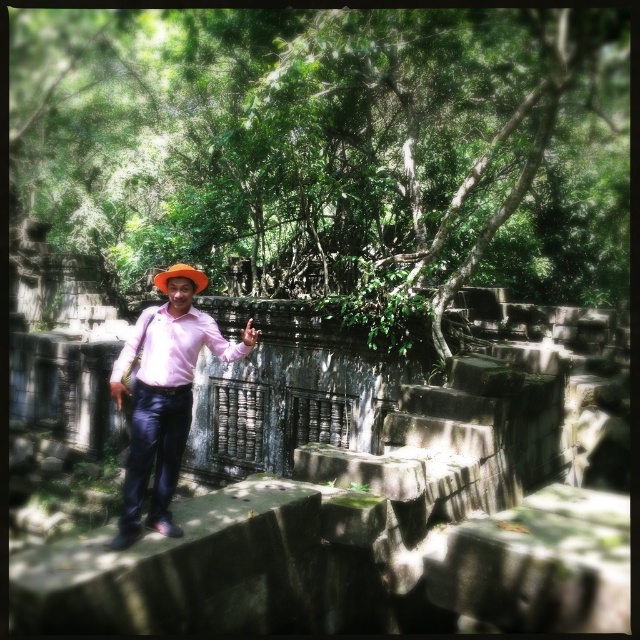
Question: Is pink matte shirt at center to the right of orange felt hat at center from the viewer's perspective?

Choices:
 (A) no
 (B) yes

Answer: (B)

Question: Among these points, which one is farthest from the camera?

Choices:
 (A) (154, 285)
 (B) (168, 336)

Answer: (A)

Question: From the image, what is the correct spatial relationship of pink matte shirt at center in relation to orange felt hat at center?

Choices:
 (A) left
 (B) right

Answer: (B)

Question: Is pink matte shirt at center thinner than orange felt hat at center?

Choices:
 (A) yes
 (B) no

Answer: (B)